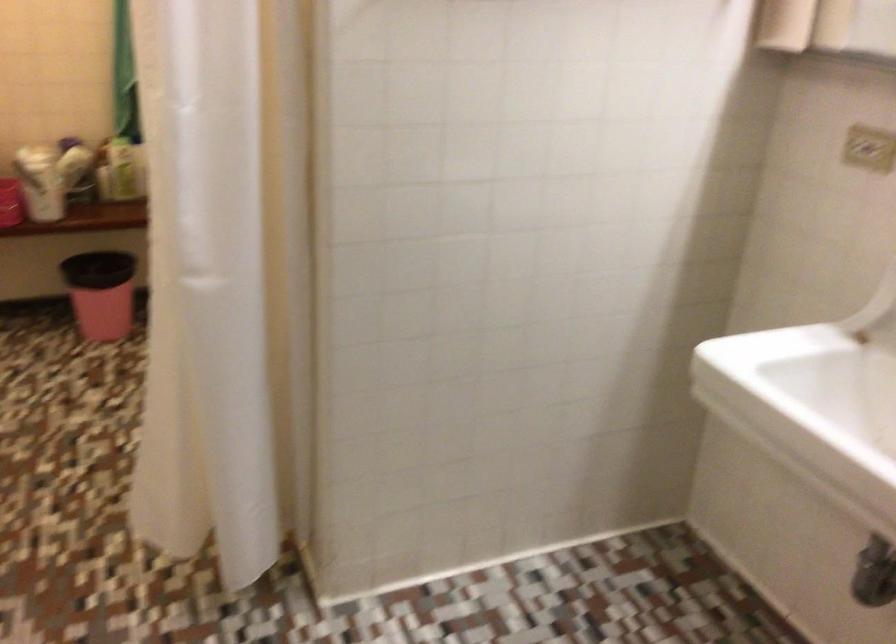
Locate an element on the screen. white bottle is located at coordinates (122, 169).